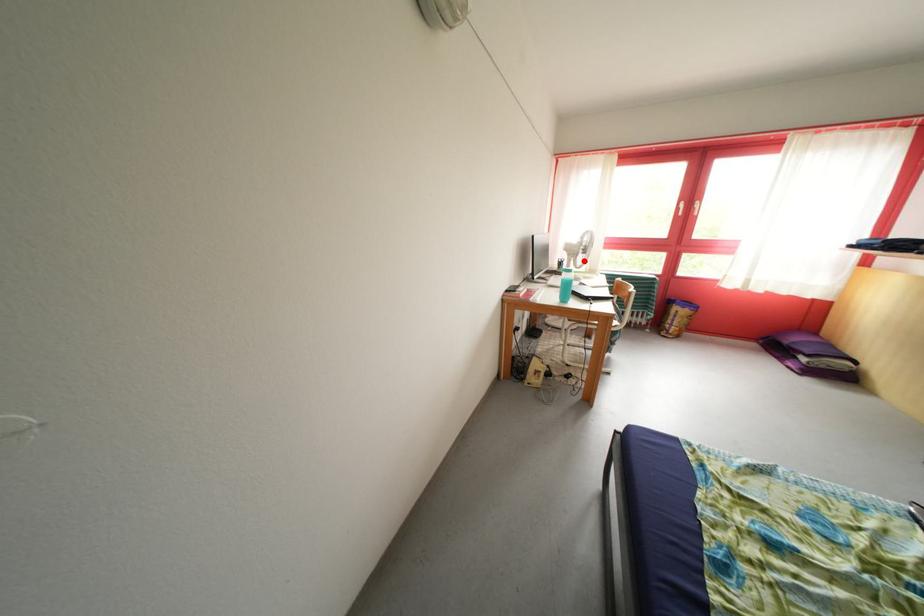
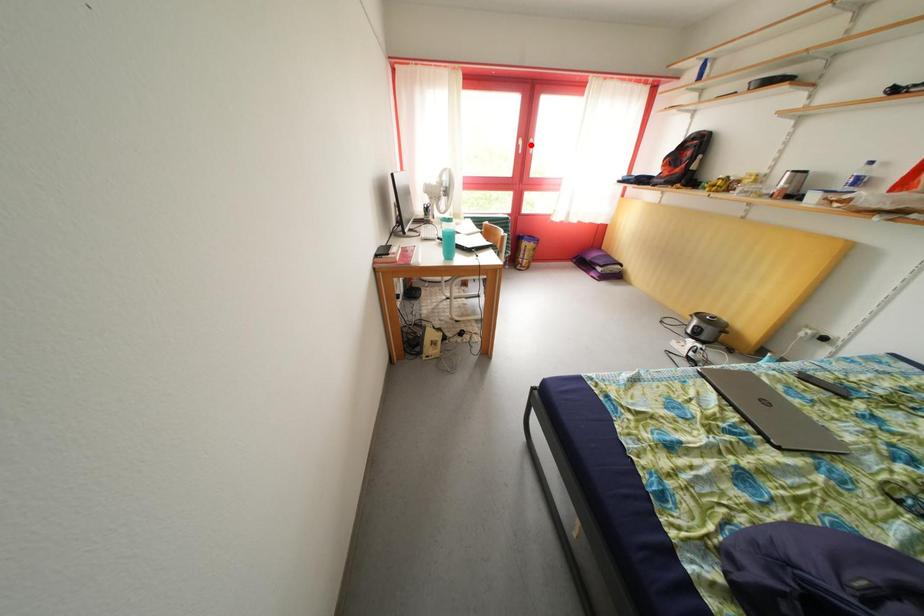
I am providing you with two images of the same scene from different viewpoints. A red point is marked on the first image and another point is marked on the second image. Are the points marked in image1 and image2 representing the same 3D position?

No